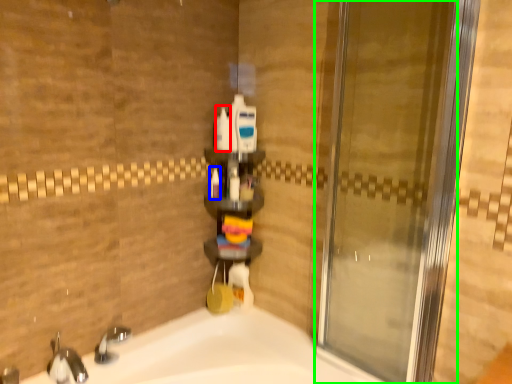
Question: Which object is positioned closest to toiletry (highlighted by a red box)? Select from toiletry (highlighted by a blue box) and door (highlighted by a green box).

Choices:
 (A) toiletry
 (B) door

Answer: (A)